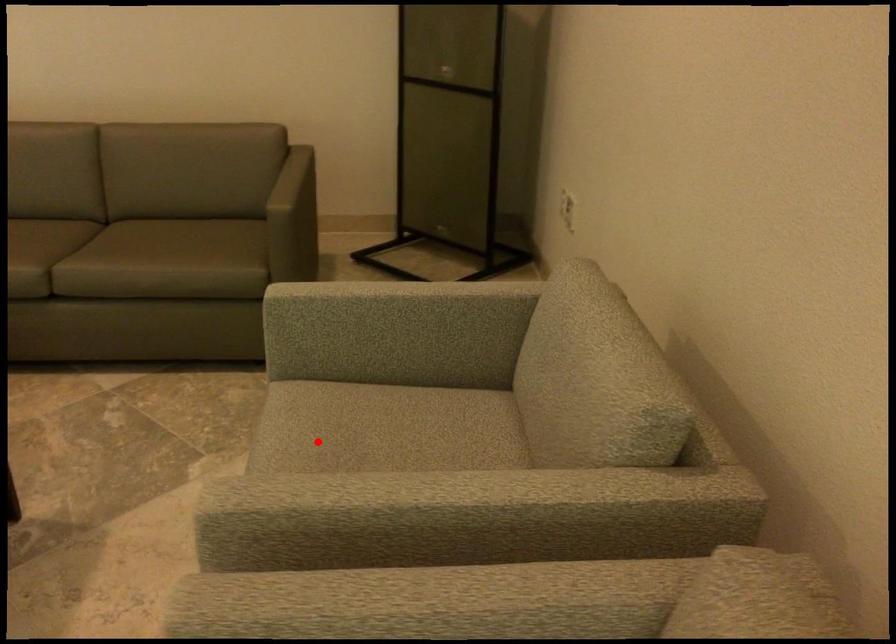
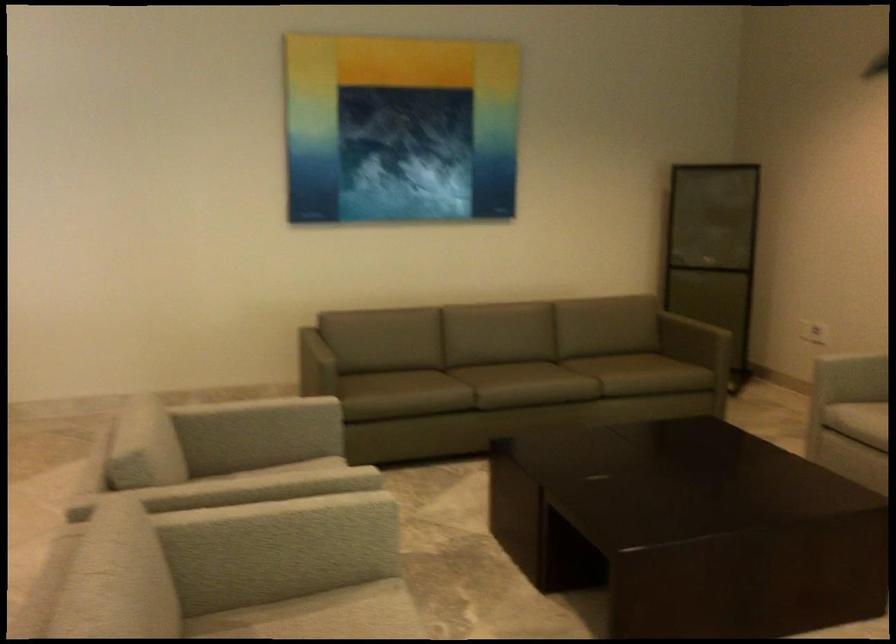
Question: I am providing you with two images of the same scene from different viewpoints. Image1 has a red point marked. In image2, the corresponding 3D location appears at what relative position? Reply with the corresponding letter.

Choices:
 (A) Closer
 (B) Farther

Answer: (B)